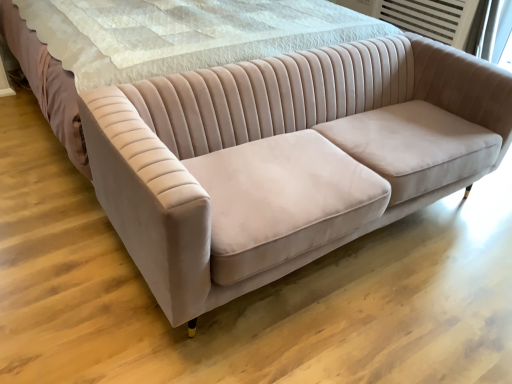
The width and height of the screenshot is (512, 384). What do you see at coordinates (257, 143) in the screenshot?
I see `matte pink velvet couch at center` at bounding box center [257, 143].

Where is `matte pink velvet couch at center`? The width and height of the screenshot is (512, 384). matte pink velvet couch at center is located at coordinates (257, 143).

What do you see at coordinates (47, 84) in the screenshot?
I see `velvet beige bed at center` at bounding box center [47, 84].

At what (x,y) coordinates should I click in order to perform the action: click on velvet beige bed at center. Please return your answer as a coordinate pair (x, y). The image size is (512, 384). Looking at the image, I should click on (47, 84).

Find the location of a particular element. matte pink velvet couch at center is located at coordinates (257, 143).

Based on their positions, is matte pink velvet couch at center located to the left or right of velvet beige bed at center?

From the image, it's evident that matte pink velvet couch at center is to the right of velvet beige bed at center.

Which object is closer to the camera, matte pink velvet couch at center or velvet beige bed at center?

matte pink velvet couch at center.

Does point (488, 106) come farther from viewer compared to point (14, 47)?

That is False.

From the image's perspective, which is above, matte pink velvet couch at center or velvet beige bed at center?

velvet beige bed at center, from the image's perspective.

From a real-world perspective, is matte pink velvet couch at center under velvet beige bed at center?

Yes, from a real-world perspective, matte pink velvet couch at center is under velvet beige bed at center.

Does matte pink velvet couch at center have a lesser width compared to velvet beige bed at center?

Yes, matte pink velvet couch at center is thinner than velvet beige bed at center.

Looking at this image, is matte pink velvet couch at center taller or shorter than velvet beige bed at center?

Clearly, matte pink velvet couch at center is shorter compared to velvet beige bed at center.

Is matte pink velvet couch at center bigger or smaller than velvet beige bed at center?

matte pink velvet couch at center is smaller than velvet beige bed at center.

Is matte pink velvet couch at center situated inside velvet beige bed at center or outside?

matte pink velvet couch at center is not enclosed by velvet beige bed at center.

Based on the photo, is matte pink velvet couch at center not near velvet beige bed at center?

No, matte pink velvet couch at center is not far away from velvet beige bed at center.

Is matte pink velvet couch at center looking in the opposite direction of velvet beige bed at center?

Yes, matte pink velvet couch at center's orientation is away from velvet beige bed at center.

What's the angular difference between matte pink velvet couch at center and velvet beige bed at center's facing directions?

There is a 1.69-degree angle between the facing directions of matte pink velvet couch at center and velvet beige bed at center.

How distant is matte pink velvet couch at center from velvet beige bed at center?

matte pink velvet couch at center is 34.34 inches away from velvet beige bed at center.

Identify the location of studio couch lying on the right of velvet beige bed at center. The image size is (512, 384). coord(257,143).

Considering the positions of objects velvet beige bed at center and matte pink velvet couch at center in the image provided, who is more to the left, velvet beige bed at center or matte pink velvet couch at center?

From the viewer's perspective, velvet beige bed at center appears more on the left side.

Does velvet beige bed at center lie in front of matte pink velvet couch at center?

No, velvet beige bed at center is further to the viewer.

Does point (77, 118) appear closer or farther from the camera than point (444, 86)?

Point (77, 118) is positioned closer to the camera compared to point (444, 86).

Based on the photo, from the image's perspective, which is above, velvet beige bed at center or matte pink velvet couch at center?

From the image's view, velvet beige bed at center is above.

From a real-world perspective, is velvet beige bed at center positioned under matte pink velvet couch at center based on gravity?

No.

In terms of width, does velvet beige bed at center look wider or thinner when compared to matte pink velvet couch at center?

In the image, velvet beige bed at center appears to be wider than matte pink velvet couch at center.

Is velvet beige bed at center taller or shorter than matte pink velvet couch at center?

In the image, velvet beige bed at center appears to be taller than matte pink velvet couch at center.

Does velvet beige bed at center have a smaller size compared to matte pink velvet couch at center?

No, velvet beige bed at center is not smaller than matte pink velvet couch at center.

Is velvet beige bed at center inside the boundaries of matte pink velvet couch at center, or outside?

velvet beige bed at center is not enclosed by matte pink velvet couch at center.

Is velvet beige bed at center in contact with matte pink velvet couch at center?

They are not placed beside each other.

Is velvet beige bed at center oriented towards matte pink velvet couch at center?

Yes, velvet beige bed at center is turned towards matte pink velvet couch at center.

What's the angular difference between velvet beige bed at center and matte pink velvet couch at center's facing directions?

velvet beige bed at center and matte pink velvet couch at center are facing 1.69 degrees away from each other.

At what (x,y) coordinates should I click in order to perform the action: click on bed above the matte pink velvet couch at center (from a real-world perspective). Please return your answer as a coordinate pair (x, y). Looking at the image, I should click on (47, 84).

Locate an element on the screen. The image size is (512, 384). bed behind the matte pink velvet couch at center is located at coordinates (47, 84).

Where is `bed above the matte pink velvet couch at center (from a real-world perspective)`? The height and width of the screenshot is (384, 512). bed above the matte pink velvet couch at center (from a real-world perspective) is located at coordinates (47, 84).